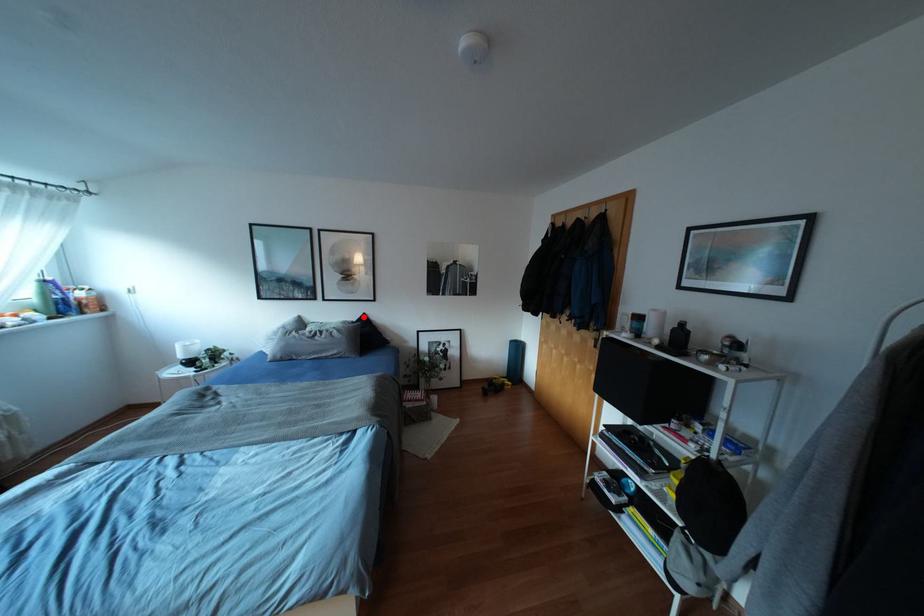
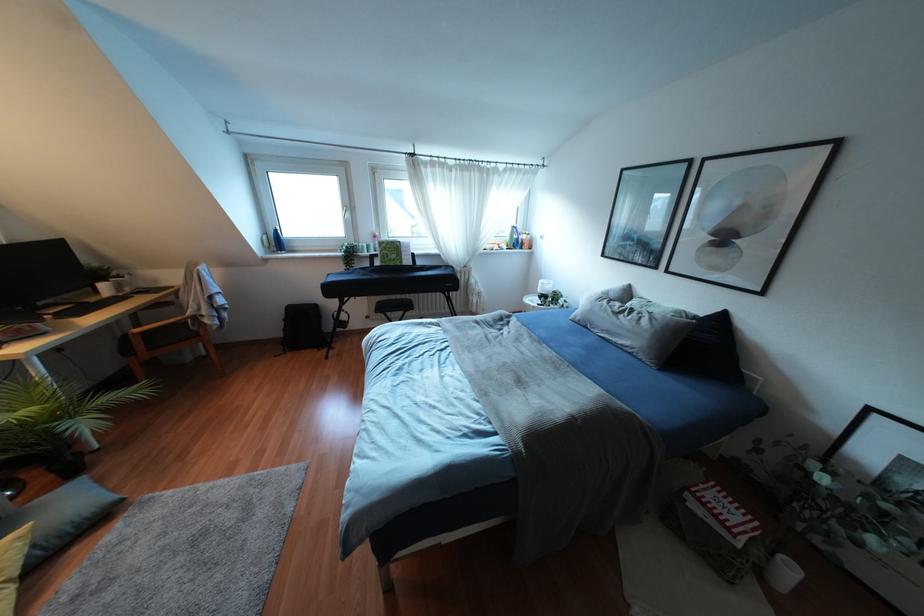
Find the pixel in the second image that matches the highlighted location in the first image.

(722, 317)